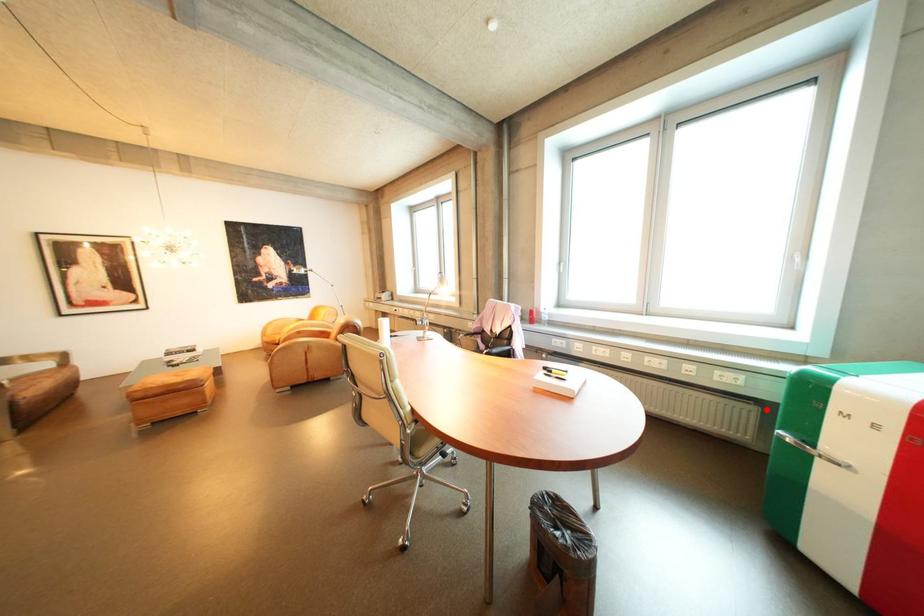
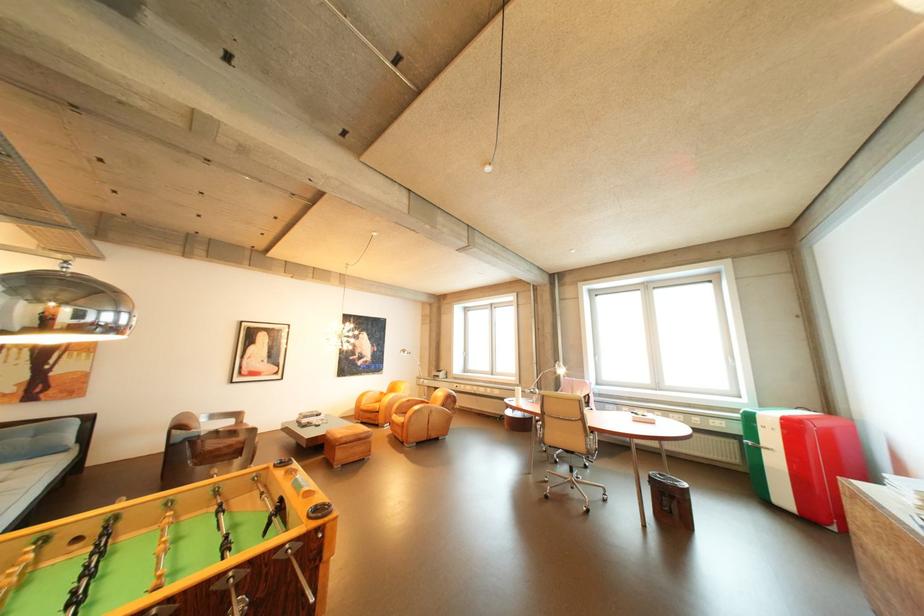
Question: I am providing you with two images of the same scene from different viewpoints. Image1 has a red point marked. In image2, the corresponding 3D location appears at what relative position? Reply with the corresponding letter.

Choices:
 (A) Closer
 (B) Farther

Answer: (B)